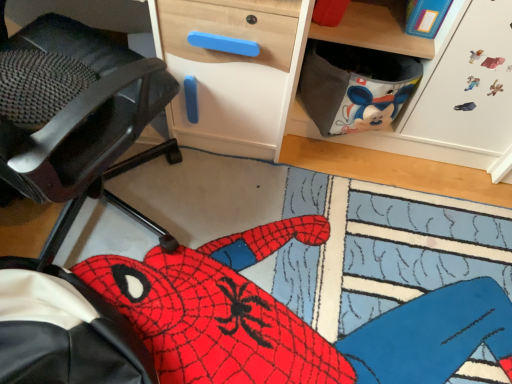
Question: Could red plush spider at lower left be considered to be inside black mesh chair at left?

Choices:
 (A) no
 (B) yes

Answer: (A)

Question: Is black mesh chair at left to the right of red plush spider at lower left from the viewer's perspective?

Choices:
 (A) yes
 (B) no

Answer: (B)

Question: Is black mesh chair at left smaller than red plush spider at lower left?

Choices:
 (A) yes
 (B) no

Answer: (A)

Question: Considering the relative sizes of black mesh chair at left and red plush spider at lower left in the image provided, is black mesh chair at left thinner than red plush spider at lower left?

Choices:
 (A) yes
 (B) no

Answer: (A)

Question: Considering the relative positions of black mesh chair at left and red plush spider at lower left in the image provided, is black mesh chair at left behind red plush spider at lower left?

Choices:
 (A) yes
 (B) no

Answer: (B)

Question: Can you confirm if black mesh chair at left is positioned to the left of red plush spider at lower left?

Choices:
 (A) no
 (B) yes

Answer: (B)

Question: Does wooden desk at upper right contain red plush spider at lower left?

Choices:
 (A) yes
 (B) no

Answer: (B)

Question: Is wooden desk at upper right facing towards red plush spider at lower left?

Choices:
 (A) yes
 (B) no

Answer: (A)

Question: Is wooden desk at upper right not within red plush spider at lower left?

Choices:
 (A) no
 (B) yes

Answer: (B)

Question: Considering the relative sizes of wooden desk at upper right and red plush spider at lower left in the image provided, is wooden desk at upper right bigger than red plush spider at lower left?

Choices:
 (A) no
 (B) yes

Answer: (B)

Question: Is wooden desk at upper right closer to the viewer compared to red plush spider at lower left?

Choices:
 (A) yes
 (B) no

Answer: (A)

Question: From the image's perspective, does wooden desk at upper right appear lower than red plush spider at lower left?

Choices:
 (A) no
 (B) yes

Answer: (A)

Question: Is wooden desk at upper right far away from black mesh chair at left?

Choices:
 (A) yes
 (B) no

Answer: (B)